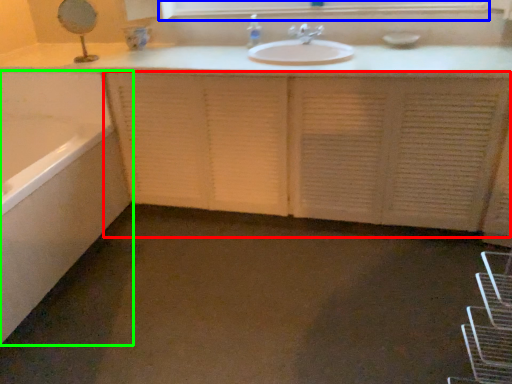
Question: Which is farther away from cabinetry (highlighted by a red box)? medicine cabinet (highlighted by a blue box) or bathtub (highlighted by a green box)?

Choices:
 (A) medicine cabinet
 (B) bathtub

Answer: (A)